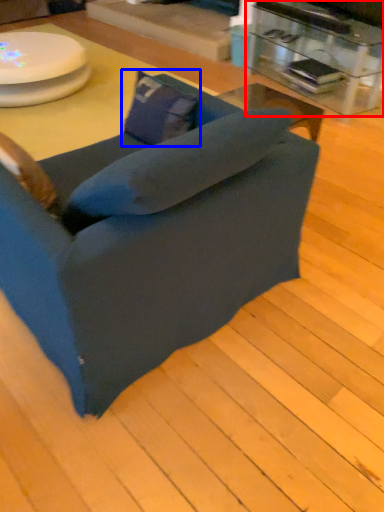
Question: Which object is closer to the camera taking this photo, table (highlighted by a red box) or pillow (highlighted by a blue box)?

Choices:
 (A) table
 (B) pillow

Answer: (B)